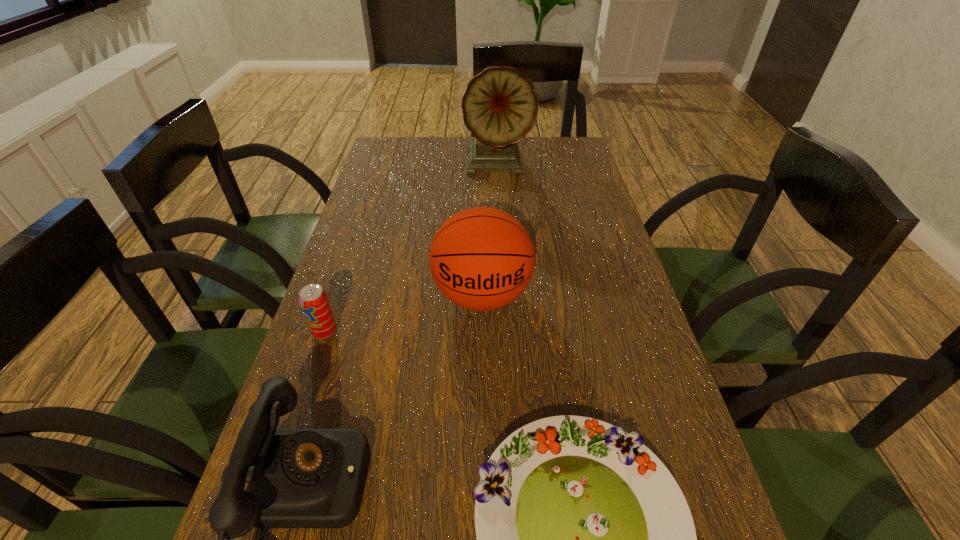
This screenshot has height=540, width=960. I want to click on free point at the left edge, so click(311, 363).

Locate an element on the screen. This screenshot has width=960, height=540. vacant space at the right edge is located at coordinates (588, 170).

This screenshot has height=540, width=960. In the image, there is a desktop. In order to click on free space at the far left corner in this screenshot , I will do `click(379, 155)`.

Identify the location of vacant space at the far right corner of the desktop. tap(554, 164).

Select which object appears as the closest to the soda can. Please provide its 2D coordinates. Your answer should be formatted as a tuple, i.e. [(x, y)], where the tuple contains the x and y coordinates of a point satisfying the conditions above.

[(297, 478)]

Locate an element on the screen. Image resolution: width=960 pixels, height=540 pixels. the third closest object to the record player is located at coordinates (297, 478).